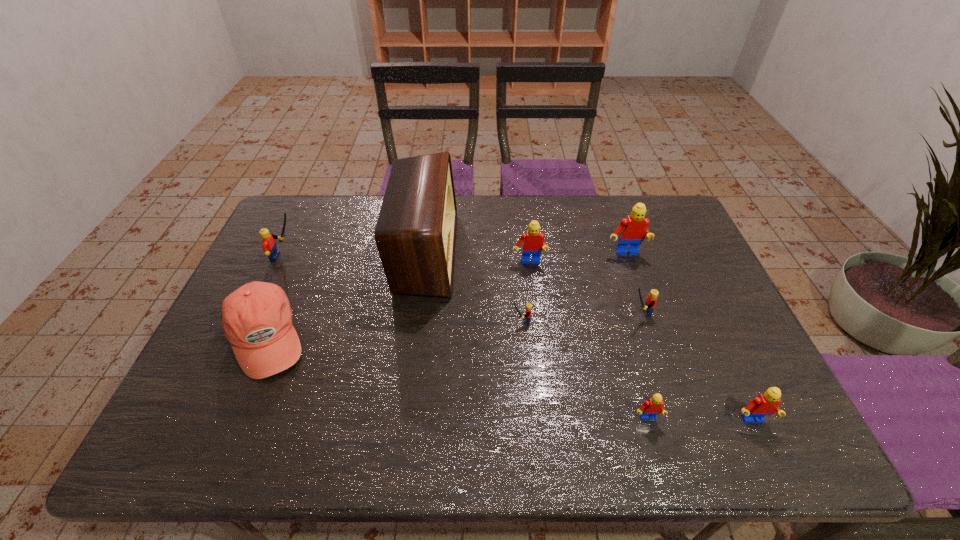
Choose which red Lego is the fourth nearest neighbor to the tallest object. Please provide its 2D coordinates. Your answer should be formatted as a tuple, i.e. [(x, y)], where the tuple contains the x and y coordinates of a point satisfying the conditions above.

[(766, 404)]

Point out which yellow Lego is positioned as the third nearest to the smallest red Lego. Please provide its 2D coordinates. Your answer should be formatted as a tuple, i.e. [(x, y)], where the tuple contains the x and y coordinates of a point satisfying the conditions above.

[(268, 243)]

The width and height of the screenshot is (960, 540). In order to click on the closest yellow Lego to the second biggest red Lego in this screenshot , I will do `click(528, 306)`.

You are a GUI agent. You are given a task and a screenshot of the screen. Output one action in this format:
    pyautogui.click(x=<x>, y=<y>)
    Task: Click on the vacant space that satisfies the following two spatial constraints: 1. on the front-facing side of the second tallest object; 2. on the front-facing side of the biggest yellow Lego
    This screenshot has height=540, width=960.
    Given the screenshot: What is the action you would take?
    pyautogui.click(x=626, y=256)

Identify the location of vacant space that satisfies the following two spatial constraints: 1. on the front-facing side of the second tallest object; 2. on the front-facing side of the second smallest yellow Lego. The height and width of the screenshot is (540, 960). (645, 312).

Locate an element on the screen. This screenshot has width=960, height=540. free spot that satisfies the following two spatial constraints: 1. on the front-facing side of the second biggest yellow Lego; 2. on the front-facing side of the smallest red Lego is located at coordinates (674, 418).

Identify the location of free space that satisfies the following two spatial constraints: 1. on the front-facing side of the leftmost red Lego; 2. on the front-facing side of the second yellow Lego from right to left. Image resolution: width=960 pixels, height=540 pixels. (536, 320).

Locate an element on the screen. vacant space that satisfies the following two spatial constraints: 1. on the front-facing side of the eighth shortest object; 2. on the front-facing side of the farthest yellow Lego is located at coordinates (626, 256).